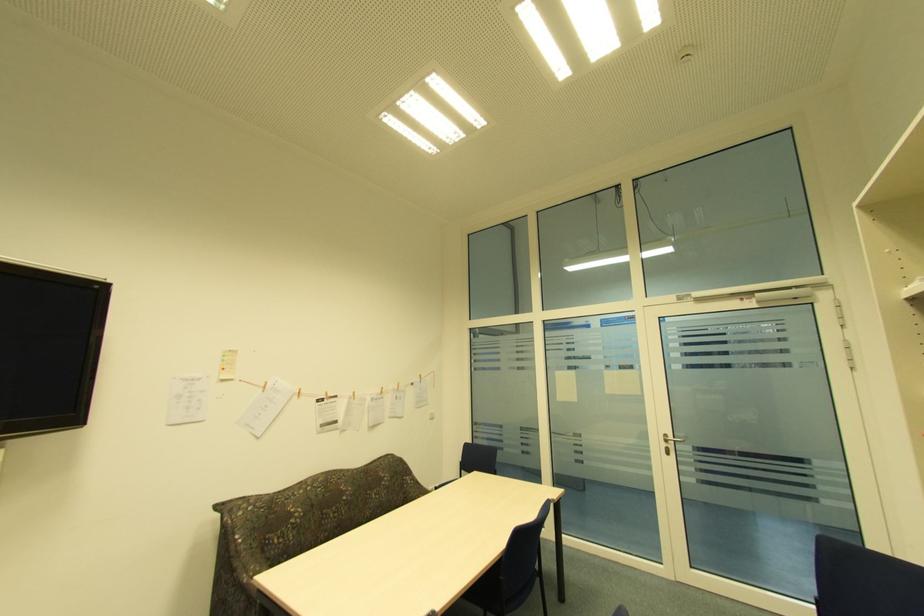
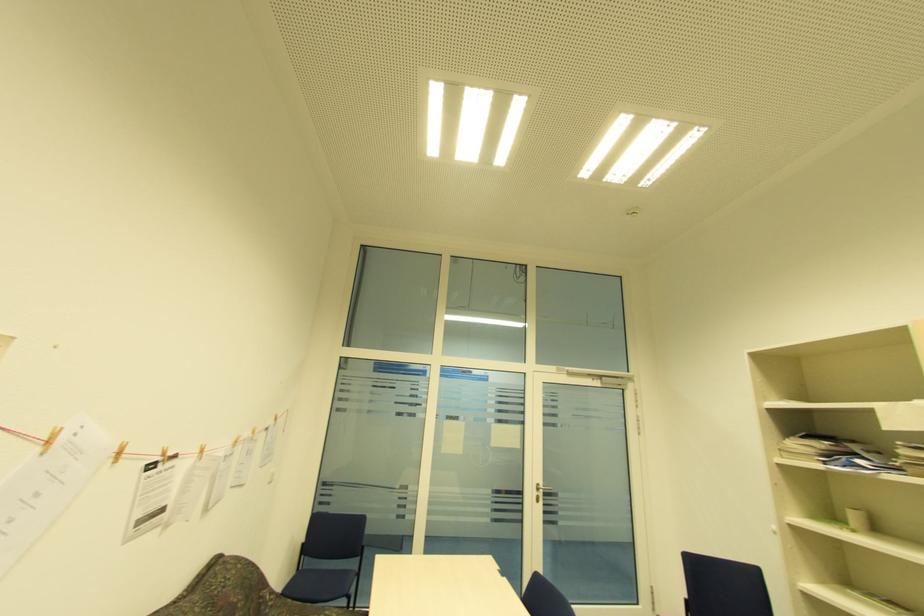
Find the pixel in the second image that matches the point at 327,394 in the first image.

(163, 454)